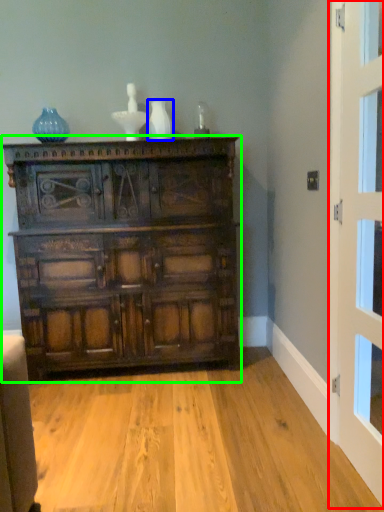
Question: Considering the real-world distances, which object is farthest from door (highlighted by a red box)? vase (highlighted by a blue box) or chest of drawers (highlighted by a green box)?

Choices:
 (A) vase
 (B) chest of drawers

Answer: (A)